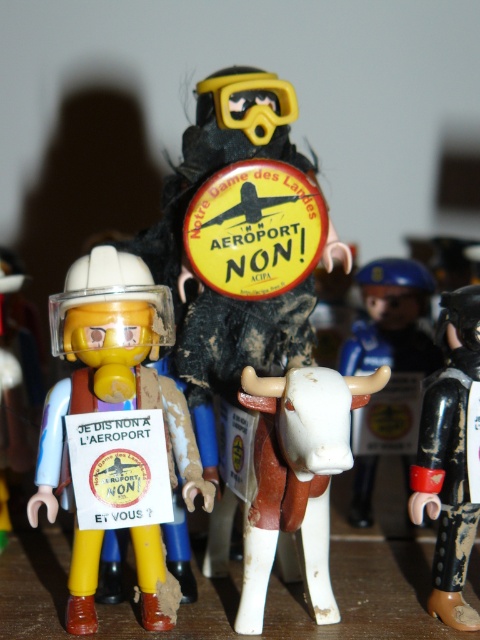
Question: Is the position of yellow matte helmet at center more distant than that of black matte figure at right?

Choices:
 (A) no
 (B) yes

Answer: (A)

Question: Which point appears closest to the camera in this image?

Choices:
 (A) (469, 372)
 (B) (115, 300)
 (C) (265, 92)

Answer: (B)

Question: Does black matte figure at right appear over white matte cow at right?

Choices:
 (A) no
 (B) yes

Answer: (A)

Question: Is yellow matte helmet at center thinner than yellow matte goggles at upper center?

Choices:
 (A) yes
 (B) no

Answer: (B)

Question: Which point is farther to the camera?

Choices:
 (A) yellow matte goggles at upper center
 (B) matte black figure at center

Answer: (B)

Question: Which object appears farthest from the camera in this image?

Choices:
 (A) white matte bull at center
 (B) white matte cow at right
 (C) black matte figure at right

Answer: (B)